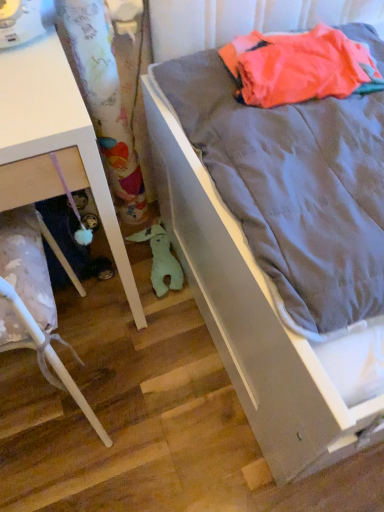
Measure the distance between point (158, 222) and camera.

The distance of point (158, 222) from camera is 1.46 meters.

The image size is (384, 512). In order to click on white glossy drawer at lower left, which is counted as the first furniture, starting from the bottom in this screenshot , I will do `click(32, 301)`.

What's the angular difference between wooden floor at lower left and white glossy drawer at lower left, which appears as the 2th furniture when viewed from the top,'s facing directions?

The angular difference between wooden floor at lower left and white glossy drawer at lower left, which appears as the 2th furniture when viewed from the top, is 91.5 degrees.

Considering the positions of points (108, 311) and (48, 343), is point (108, 311) closer to camera compared to point (48, 343)?

That is False.

Is wooden floor at lower left to the left of white glossy drawer at lower left, which appears as the 2th furniture when viewed from the top, from the viewer's perspective?

No, wooden floor at lower left is not to the left of white glossy drawer at lower left, which appears as the 2th furniture when viewed from the top.

Between wooden floor at lower left and white glossy drawer at lower left, which appears as the 2th furniture when viewed from the top, which one has larger size?

white glossy drawer at lower left, which appears as the 2th furniture when viewed from the top, is bigger.

Consider the image. Considering the sizes of green plush toy at lower center and white glossy drawer at lower left, the 2th furniture in the bottom-to-top sequence, in the image, is green plush toy at lower center bigger or smaller than white glossy drawer at lower left, the 2th furniture in the bottom-to-top sequence,?

Considering their sizes, green plush toy at lower center takes up less space than white glossy drawer at lower left, the 2th furniture in the bottom-to-top sequence.

Can you confirm if green plush toy at lower center is taller than white glossy drawer at lower left, the 2th furniture in the bottom-to-top sequence?

No, green plush toy at lower center is not taller than white glossy drawer at lower left, the 2th furniture in the bottom-to-top sequence.

Looking at this image, is green plush toy at lower center further to the viewer compared to white glossy drawer at lower left, the first furniture in the top-to-bottom sequence?

Yes, green plush toy at lower center is further from the camera.

From a real-world perspective, which is physically above, green plush toy at lower center or white glossy drawer at lower left, the 2th furniture in the bottom-to-top sequence?

white glossy drawer at lower left, the 2th furniture in the bottom-to-top sequence, from a real-world perspective.

Considering the relative positions of white glossy drawer at lower left, the 2th furniture in the bottom-to-top sequence, and gray fabric bed at right in the image provided, is white glossy drawer at lower left, the 2th furniture in the bottom-to-top sequence, to the left or to the right of gray fabric bed at right?

From the image, it's evident that white glossy drawer at lower left, the 2th furniture in the bottom-to-top sequence, is to the left of gray fabric bed at right.

In the scene shown: Does white glossy drawer at lower left, the first furniture in the top-to-bottom sequence, have a greater height compared to gray fabric bed at right?

Incorrect, the height of white glossy drawer at lower left, the first furniture in the top-to-bottom sequence, is not larger of that of gray fabric bed at right.

Is point (6, 59) farther from camera compared to point (241, 205)?

Yes, point (6, 59) is farther from viewer.

Is white glossy drawer at lower left, the first furniture in the top-to-bottom sequence, wider than gray fabric bed at right?

No.

Locate an element on the screen. Image resolution: width=384 pixels, height=512 pixels. stair on the left of gray fabric bed at right is located at coordinates (128, 413).

Is gray fabric bed at right to the left of wooden floor at lower left from the viewer's perspective?

No, gray fabric bed at right is not to the left of wooden floor at lower left.

Who is more distant, gray fabric bed at right or wooden floor at lower left?

wooden floor at lower left is more distant.

Is there a large distance between white glossy drawer at lower left, the first furniture in the top-to-bottom sequence, and wooden floor at lower left?

No, white glossy drawer at lower left, the first furniture in the top-to-bottom sequence, is not far from wooden floor at lower left.

Is white glossy drawer at lower left, the 2th furniture in the bottom-to-top sequence, positioned with its back to wooden floor at lower left?

No, white glossy drawer at lower left, the 2th furniture in the bottom-to-top sequence,'s orientation is not away from wooden floor at lower left.

How many degrees apart are the facing directions of white glossy drawer at lower left, the first furniture in the top-to-bottom sequence, and wooden floor at lower left?

88.5 degrees separate the facing orientations of white glossy drawer at lower left, the first furniture in the top-to-bottom sequence, and wooden floor at lower left.

Which is more to the left, white glossy drawer at lower left, the 2th furniture in the bottom-to-top sequence, or wooden floor at lower left?

white glossy drawer at lower left, the 2th furniture in the bottom-to-top sequence, is more to the left.

Which of these two, white glossy drawer at lower left, which is counted as the first furniture, starting from the bottom, or wooden floor at lower left, is wider?

wooden floor at lower left is wider.

I want to click on stair below the white glossy drawer at lower left, which is counted as the first furniture, starting from the bottom (from a real-world perspective), so click(x=128, y=413).

Does point (44, 264) come behind point (64, 290)?

That is False.

From the image's perspective, is wooden floor at lower left below green plush toy at lower center?

Indeed, from the image's perspective, wooden floor at lower left is shown beneath green plush toy at lower center.

Would you say wooden floor at lower left contains green plush toy at lower center?

No, green plush toy at lower center is located outside of wooden floor at lower left.

Considering the relative positions of wooden floor at lower left and green plush toy at lower center in the image provided, is wooden floor at lower left to the left of green plush toy at lower center from the viewer's perspective?

No, wooden floor at lower left is not to the left of green plush toy at lower center.

From a real-world perspective, starting from the wooden floor at lower left, which furniture is the 2nd one vertically above it? Please provide its 2D coordinates.

[(32, 301)]

What are the coordinates of `furniture that is the 2nd object to the left of the green plush toy at lower center, starting at the anchor` in the screenshot? It's located at (53, 143).

Which object lies nearer to the anchor point gray fabric bed at right, white glossy drawer at lower left, which is counted as the first furniture, starting from the bottom, or wooden floor at lower left?

wooden floor at lower left is positioned closer to the anchor gray fabric bed at right.

Looking at the image, which one is located further to green plush toy at lower center, white glossy drawer at lower left, the first furniture in the top-to-bottom sequence, or wooden floor at lower left?

Among the two, white glossy drawer at lower left, the first furniture in the top-to-bottom sequence, is located further to green plush toy at lower center.

Considering their positions, is wooden floor at lower left positioned closer to white glossy drawer at lower left, the first furniture in the top-to-bottom sequence, than green plush toy at lower center?

wooden floor at lower left.

Which object lies nearer to the anchor point wooden floor at lower left, white glossy drawer at lower left, the 2th furniture in the bottom-to-top sequence, or gray fabric bed at right?

white glossy drawer at lower left, the 2th furniture in the bottom-to-top sequence, is positioned closer to the anchor wooden floor at lower left.

Which object lies further to the anchor point wooden floor at lower left, white glossy drawer at lower left, which is counted as the first furniture, starting from the bottom, or green plush toy at lower center?

green plush toy at lower center is positioned further to the anchor wooden floor at lower left.

From the picture: When comparing their distances from green plush toy at lower center, does white glossy drawer at lower left, the 2th furniture in the bottom-to-top sequence, or white glossy drawer at lower left, which is counted as the first furniture, starting from the bottom, seem further?

white glossy drawer at lower left, the 2th furniture in the bottom-to-top sequence, is further to green plush toy at lower center.

Looking at the image, which one is located closer to gray fabric bed at right, white glossy drawer at lower left, the first furniture in the top-to-bottom sequence, or white glossy drawer at lower left, which appears as the 2th furniture when viewed from the top?

white glossy drawer at lower left, the first furniture in the top-to-bottom sequence, is closer to gray fabric bed at right.

From the picture: Looking at the image, which one is located further to wooden floor at lower left, green plush toy at lower center or white glossy drawer at lower left, the 2th furniture in the bottom-to-top sequence?

The object further to wooden floor at lower left is white glossy drawer at lower left, the 2th furniture in the bottom-to-top sequence.

The image size is (384, 512). Find the location of `stair located between gray fabric bed at right and green plush toy at lower center in the depth direction`. stair located between gray fabric bed at right and green plush toy at lower center in the depth direction is located at coordinates (128, 413).

At what (x,y) coordinates should I click in order to perform the action: click on stair positioned between white glossy drawer at lower left, which is counted as the first furniture, starting from the bottom, and green plush toy at lower center from near to far. Please return your answer as a coordinate pair (x, y). Image resolution: width=384 pixels, height=512 pixels. Looking at the image, I should click on (128, 413).

Locate an element on the screen. The height and width of the screenshot is (512, 384). furniture between white glossy drawer at lower left, the 2th furniture in the bottom-to-top sequence, and gray fabric bed at right, in the horizontal direction is located at coordinates (32, 301).

I want to click on stair situated between white glossy drawer at lower left, which is counted as the first furniture, starting from the bottom, and gray fabric bed at right from left to right, so click(128, 413).